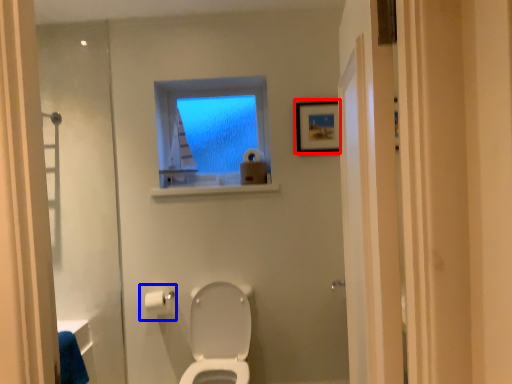
Question: Which of the following is the farthest to the observer, picture frame (highlighted by a red box) or toilet paper (highlighted by a blue box)?

Choices:
 (A) picture frame
 (B) toilet paper

Answer: (A)